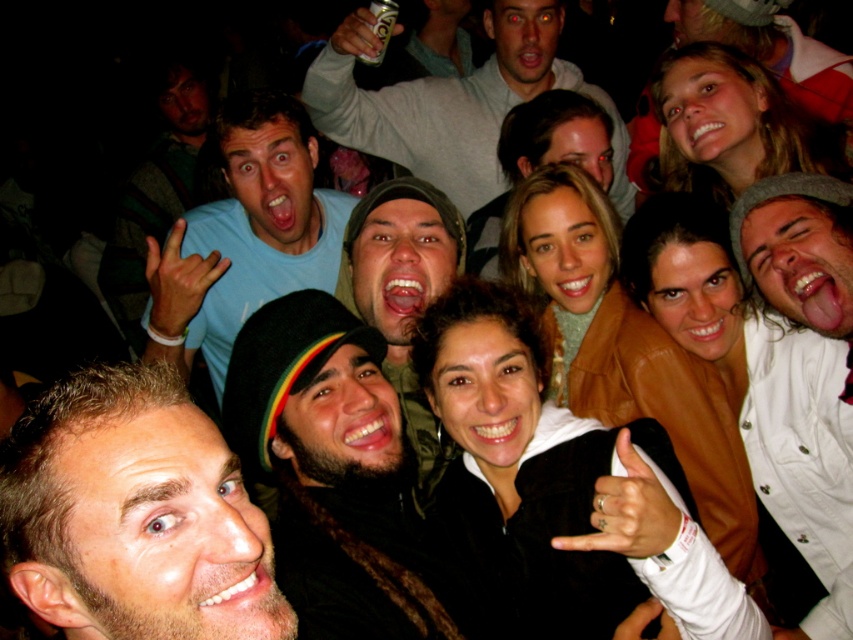
Question: Among these points, which one is farthest from the camera?

Choices:
 (A) (433, 458)
 (B) (827, 355)
 (C) (91, 490)

Answer: (A)

Question: Which of the following is the closest to the observer?

Choices:
 (A) (439, 195)
 (B) (279, 301)

Answer: (B)

Question: Is light brown hair at center below green textured hoodie at center?

Choices:
 (A) yes
 (B) no

Answer: (A)

Question: Can you confirm if white cotton shirt at upper right is positioned above green textured hoodie at center?

Choices:
 (A) no
 (B) yes

Answer: (A)

Question: Can you confirm if light blue t-shirt at center is positioned to the right of green textured hoodie at center?

Choices:
 (A) yes
 (B) no

Answer: (B)

Question: Which object appears closest to the camera in this image?

Choices:
 (A) green textured hoodie at center
 (B) black knit cap at center
 (C) gray sweater at upper center

Answer: (B)